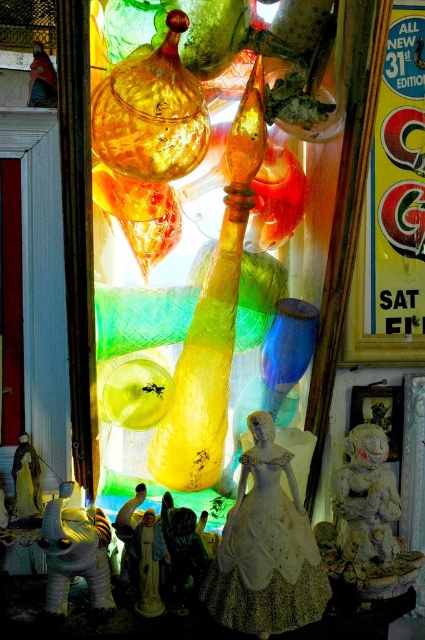
Who is positioned more to the right, white matte elephant at lower left or white porcelain figurine at center?

Positioned to the right is white porcelain figurine at center.

Where is `white matte elephant at lower left`? This screenshot has height=640, width=425. white matte elephant at lower left is located at coordinates (74, 552).

Where is `white matte elephant at lower left`? white matte elephant at lower left is located at coordinates (74, 552).

Between white lace dress at center and white stone figurine at lower right, which one has more height?

white lace dress at center

What do you see at coordinates (266, 554) in the screenshot? I see `white lace dress at center` at bounding box center [266, 554].

You are a GUI agent. You are given a task and a screenshot of the screen. Output one action in this format:
    pyautogui.click(x=<x>, y=<y>)
    Task: Click on the white lace dress at center
    This screenshot has width=425, height=640.
    Given the screenshot: What is the action you would take?
    pyautogui.click(x=266, y=554)

Is point (272, 612) positioned before point (141, 608)?

Yes, it is in front of point (141, 608).

Does white lace dress at center have a smaller size compared to white porcelain figurine at center?

No.

Is point (223, 620) closer to viewer compared to point (139, 538)?

Yes, it is in front of point (139, 538).

You are a GUI agent. You are given a task and a screenshot of the screen. Output one action in this format:
    pyautogui.click(x=<x>, y=<y>)
    Task: Click on the white lace dress at center
    
    Given the screenshot: What is the action you would take?
    coord(266,554)